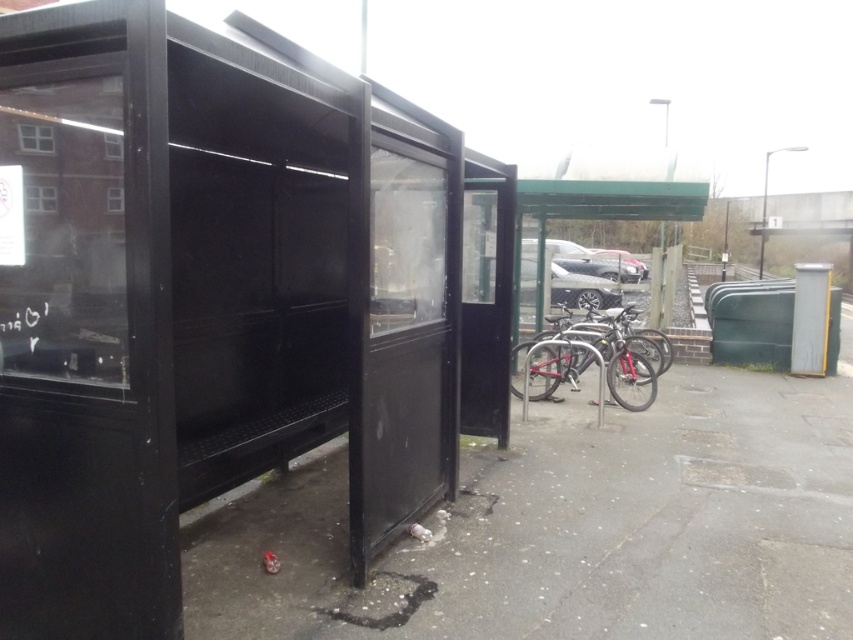
Which is above, black matte bus stop at left or shiny metallic bicycle at center?

black matte bus stop at left

Does point (294, 445) come farther from viewer compared to point (606, 321)?

No, (294, 445) is in front of (606, 321).

Between point (61, 493) and point (624, 324), which one is positioned in front?

Positioned in front is point (61, 493).

I want to click on black matte bus stop at left, so tap(206, 298).